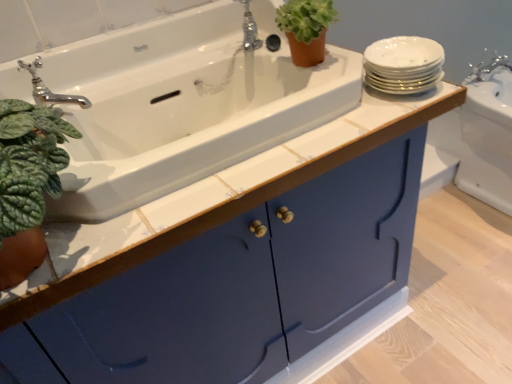
Image resolution: width=512 pixels, height=384 pixels. What do you see at coordinates (403, 64) in the screenshot?
I see `white porcelain plates at upper right` at bounding box center [403, 64].

At what (x,y) coordinates should I click in order to perform the action: click on white porcelain plates at upper right. Please return your answer as a coordinate pair (x, y). Looking at the image, I should click on (403, 64).

This screenshot has height=384, width=512. What do you see at coordinates (48, 89) in the screenshot?
I see `chrome metallic faucet at upper left, the 2th tap from the right` at bounding box center [48, 89].

The width and height of the screenshot is (512, 384). Find the location of `white glossy sink at upper right, the first sink from the back`. white glossy sink at upper right, the first sink from the back is located at coordinates (482, 134).

Describe the element at coordinates (482, 134) in the screenshot. This screenshot has height=384, width=512. I see `white glossy sink at upper right, placed as the 1th sink when sorted from right to left` at that location.

Image resolution: width=512 pixels, height=384 pixels. I want to click on white porcelain plates at upper right, so click(403, 64).

Which of these two, white porcelain plates at upper right or chrome metallic faucet at upper left, positioned as the first tap in bottom-to-top order, stands shorter?

Standing shorter between the two is white porcelain plates at upper right.

How much distance is there between white porcelain plates at upper right and chrome metallic faucet at upper left, the 1th tap from the left?

white porcelain plates at upper right is 64.05 centimeters away from chrome metallic faucet at upper left, the 1th tap from the left.

Does white porcelain plates at upper right have a lesser width compared to chrome metallic faucet at upper left, the 2th tap when ordered from back to front?

Incorrect, the width of white porcelain plates at upper right is not less than that of chrome metallic faucet at upper left, the 2th tap when ordered from back to front.

Consider the image. Between white porcelain plates at upper right and chrome metallic faucet at upper left, marked as the second tap in a top-to-bottom arrangement, which one appears on the left side from the viewer's perspective?

chrome metallic faucet at upper left, marked as the second tap in a top-to-bottom arrangement, is more to the left.

Would you say chrome metallic faucet at upper left, positioned as the first tap in bottom-to-top order, is outside white porcelain plates at upper right?

chrome metallic faucet at upper left, positioned as the first tap in bottom-to-top order, is positioned outside white porcelain plates at upper right.

Based on their positions, is chrome metallic faucet at upper left, positioned as the first tap in bottom-to-top order, located to the left or right of white porcelain plates at upper right?

Based on their positions, chrome metallic faucet at upper left, positioned as the first tap in bottom-to-top order, is located to the left of white porcelain plates at upper right.

Is chrome metallic faucet at upper left, marked as the second tap in a top-to-bottom arrangement, oriented towards white porcelain plates at upper right?

No.

Can you see chrome metallic faucet at upper left, the first tap in the front-to-back sequence, touching white porcelain plates at upper right?

They are not placed beside each other.

Considering the sizes of objects white ceramic sink at upper left, the 2th sink from the back, and matte blue cabinet at center in the image provided, who is bigger, white ceramic sink at upper left, the 2th sink from the back, or matte blue cabinet at center?

matte blue cabinet at center is bigger.

Is white ceramic sink at upper left, the 2th sink from the back, inside or outside of matte blue cabinet at center?

white ceramic sink at upper left, the 2th sink from the back, is spatially positioned inside matte blue cabinet at center.

Which point is more distant from viewer, (130, 81) or (365, 214)?

Positioned behind is point (130, 81).

From the image's perspective, between white ceramic sink at upper left, the 2th sink from the back, and matte blue cabinet at center, who is located below?

From the image's view, matte blue cabinet at center is below.

Considering the relative positions of matte blue cabinet at center and polished chrome faucet at upper center, acting as the 2th tap starting from the bottom, in the image provided, is matte blue cabinet at center to the right of polished chrome faucet at upper center, acting as the 2th tap starting from the bottom, from the viewer's perspective?

No, matte blue cabinet at center is not to the right of polished chrome faucet at upper center, acting as the 2th tap starting from the bottom.

Does point (347, 305) come farther from viewer compared to point (247, 42)?

Yes, it is behind point (247, 42).

From the image's perspective, is matte blue cabinet at center under polished chrome faucet at upper center, positioned as the second tap in left-to-right order?

Correct, matte blue cabinet at center appears lower than polished chrome faucet at upper center, positioned as the second tap in left-to-right order, in the image.

The image size is (512, 384). Find the location of `bathroom cabinet above the white glossy sink at upper right, the first sink from the back (from a real-world perspective)`. bathroom cabinet above the white glossy sink at upper right, the first sink from the back (from a real-world perspective) is located at coordinates (233, 261).

Could matte blue cabinet at center be considered to be inside white glossy sink at upper right, the 2th sink from the front?

Definitely not — matte blue cabinet at center is not inside white glossy sink at upper right, the 2th sink from the front.

From the picture: Who is smaller, white glossy sink at upper right, which is the second sink from left to right, or matte blue cabinet at center?

With smaller size is white glossy sink at upper right, which is the second sink from left to right.

From a real-world perspective, who is located lower, white glossy sink at upper right, the 2th sink from the front, or matte blue cabinet at center?

In real-world perspective, white glossy sink at upper right, the 2th sink from the front, is lower.

From their relative heights in the image, would you say polished chrome faucet at upper center, the first tap when ordered from back to front, is taller or shorter than white porcelain plates at upper right?

Considering their sizes, polished chrome faucet at upper center, the first tap when ordered from back to front, has more height than white porcelain plates at upper right.

Between polished chrome faucet at upper center, which appears as the 1th tap when viewed from the top, and white porcelain plates at upper right, which one appears on the right side from the viewer's perspective?

From the viewer's perspective, white porcelain plates at upper right appears more on the right side.

From the image's perspective, is polished chrome faucet at upper center, positioned as the second tap in left-to-right order, on white porcelain plates at upper right?

Correct, polished chrome faucet at upper center, positioned as the second tap in left-to-right order, appears higher than white porcelain plates at upper right in the image.

Does polished chrome faucet at upper center, the first tap when ordered from back to front, contain white porcelain plates at upper right?

No.

In the image, is polished chrome faucet at upper center, which appears as the 1th tap when viewed from the top, positioned in front of or behind matte blue cabinet at center?

Clearly, polished chrome faucet at upper center, which appears as the 1th tap when viewed from the top, is behind matte blue cabinet at center.

Between polished chrome faucet at upper center, the first tap positioned from the right, and matte blue cabinet at center, which one has more height?

matte blue cabinet at center.

Considering the sizes of objects polished chrome faucet at upper center, acting as the 2th tap starting from the bottom, and matte blue cabinet at center in the image provided, who is smaller, polished chrome faucet at upper center, acting as the 2th tap starting from the bottom, or matte blue cabinet at center?

With smaller size is polished chrome faucet at upper center, acting as the 2th tap starting from the bottom.

Find the location of a particular element. The width and height of the screenshot is (512, 384). tap that is the 1st object located behind the white porcelain plates at upper right is located at coordinates (48, 89).

The width and height of the screenshot is (512, 384). Find the location of `tap lying below the white porcelain plates at upper right (from the image's perspective)`. tap lying below the white porcelain plates at upper right (from the image's perspective) is located at coordinates pos(48,89).

Which object lies further to the anchor point white porcelain plates at upper right, chrome metallic faucet at upper left, marked as the second tap in a top-to-bottom arrangement, or white glossy sink at upper right, placed as the 1th sink when sorted from right to left?

Among the two, white glossy sink at upper right, placed as the 1th sink when sorted from right to left, is located further to white porcelain plates at upper right.

In the scene shown: Which object lies nearer to the anchor point chrome metallic faucet at upper left, marked as the second tap in a top-to-bottom arrangement, matte blue cabinet at center or white porcelain plates at upper right?

The object closer to chrome metallic faucet at upper left, marked as the second tap in a top-to-bottom arrangement, is matte blue cabinet at center.

From the picture: From the image, which object appears to be nearer to chrome metallic faucet at upper left, the 2th tap from the right, white ceramic sink at upper left, the 2th sink when ordered from right to left, or polished chrome faucet at upper center, the first tap positioned from the right?

Among the two, white ceramic sink at upper left, the 2th sink when ordered from right to left, is located nearer to chrome metallic faucet at upper left, the 2th tap from the right.

Looking at the image, which one is located closer to white ceramic sink at upper left, which ranks as the first sink in left-to-right order, white porcelain plates at upper right or chrome metallic faucet at upper left, the first tap in the front-to-back sequence?

chrome metallic faucet at upper left, the first tap in the front-to-back sequence, is positioned closer to the anchor white ceramic sink at upper left, which ranks as the first sink in left-to-right order.

Considering their positions, is matte blue cabinet at center positioned closer to white porcelain plates at upper right than white ceramic sink at upper left, the 2th sink from the back?

white ceramic sink at upper left, the 2th sink from the back, lies closer to white porcelain plates at upper right than the other object.

Based on their spatial positions, is white ceramic sink at upper left, which ranks as the first sink in left-to-right order, or white porcelain plates at upper right further from matte blue cabinet at center?

white porcelain plates at upper right is positioned further to the anchor matte blue cabinet at center.

Based on their spatial positions, is white glossy sink at upper right, which is the second sink from left to right, or white porcelain plates at upper right closer to polished chrome faucet at upper center, positioned as the second tap in left-to-right order?

white porcelain plates at upper right is positioned closer to the anchor polished chrome faucet at upper center, positioned as the second tap in left-to-right order.

Based on their spatial positions, is polished chrome faucet at upper center, which is the second tap in front-to-back order, or chrome metallic faucet at upper left, the 1th tap from the left, closer to matte blue cabinet at center?

chrome metallic faucet at upper left, the 1th tap from the left, lies closer to matte blue cabinet at center than the other object.

You are a GUI agent. You are given a task and a screenshot of the screen. Output one action in this format:
    pyautogui.click(x=<x>, y=<y>)
    Task: Click on the sink located between matte blue cabinet at center and white porcelain plates at upper right in the left-right direction
    This screenshot has height=384, width=512.
    Given the screenshot: What is the action you would take?
    pyautogui.click(x=181, y=107)

Identify the location of sink between chrome metallic faucet at upper left, the 1th tap from the left, and white glossy sink at upper right, which is the second sink from left to right, from left to right. (181, 107).

The width and height of the screenshot is (512, 384). I want to click on tap between polished chrome faucet at upper center, which is the second tap in front-to-back order, and matte blue cabinet at center in the up-down direction, so click(48, 89).

Find the location of a particular element. This screenshot has height=384, width=512. bathroom cabinet between chrome metallic faucet at upper left, the 2th tap from the right, and white porcelain plates at upper right is located at coordinates (233, 261).